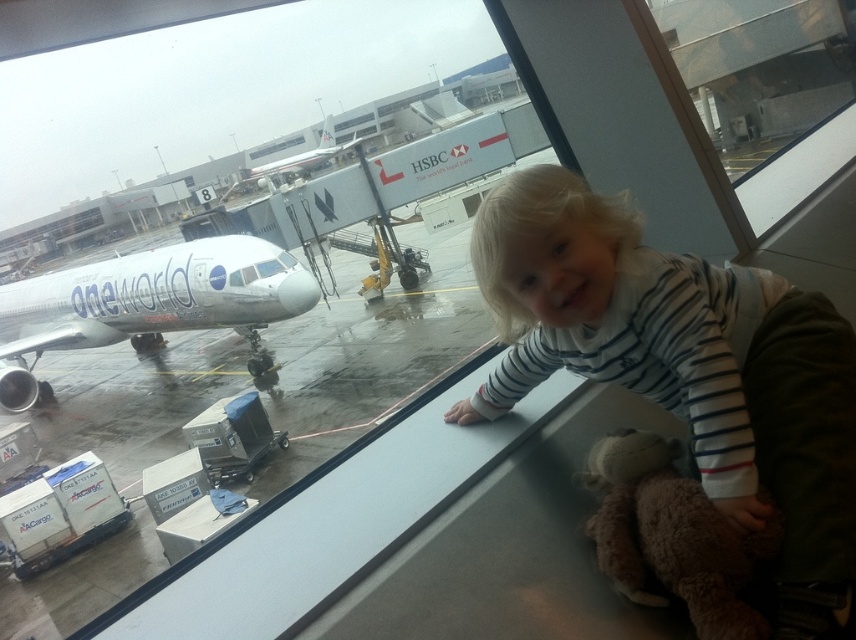
You are an airport maintenance worker who needs to inspect both the white glossy airplane at left and the silver metallic airplane at center. Your ladder is 5 meters long. Can you safely reach both airplanes from your current position using the ladder without moving it?

The white glossy airplane at left and silver metallic airplane at center are 4.93 meters apart. Since your ladder is 5 meters long, it can span the distance between them, allowing you to safely reach both airplanes without moving the ladder.